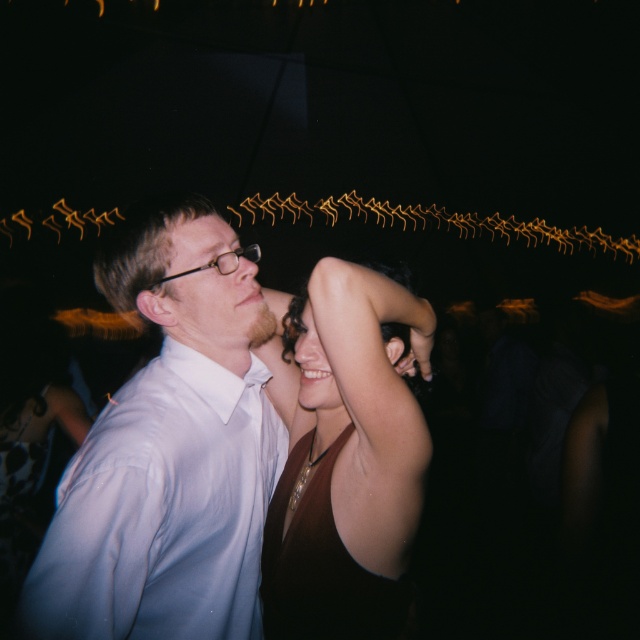
Question: Is matte brown dress at center smaller than matte skin at center?

Choices:
 (A) yes
 (B) no

Answer: (B)

Question: Does white glossy shirt at center appear on the left side of matte skin at center?

Choices:
 (A) yes
 (B) no

Answer: (A)

Question: Which is farther from the matte brown dress at center?

Choices:
 (A) smooth skin at center
 (B) matte skin at center
 (C) satin burgundy dress at center

Answer: (B)

Question: Which object is closer to the camera taking this photo?

Choices:
 (A) matte brown dress at center
 (B) matte skin at center
 (C) matte white face at center
 (D) white glossy shirt at center

Answer: (A)

Question: Can you confirm if matte brown dress at center is positioned to the left of smooth skin at center?

Choices:
 (A) no
 (B) yes

Answer: (A)

Question: Which of the following is the closest to the observer?

Choices:
 (A) matte skin at center
 (B) white glossy shirt at center
 (C) smooth skin at center
 (D) satin burgundy dress at center

Answer: (B)